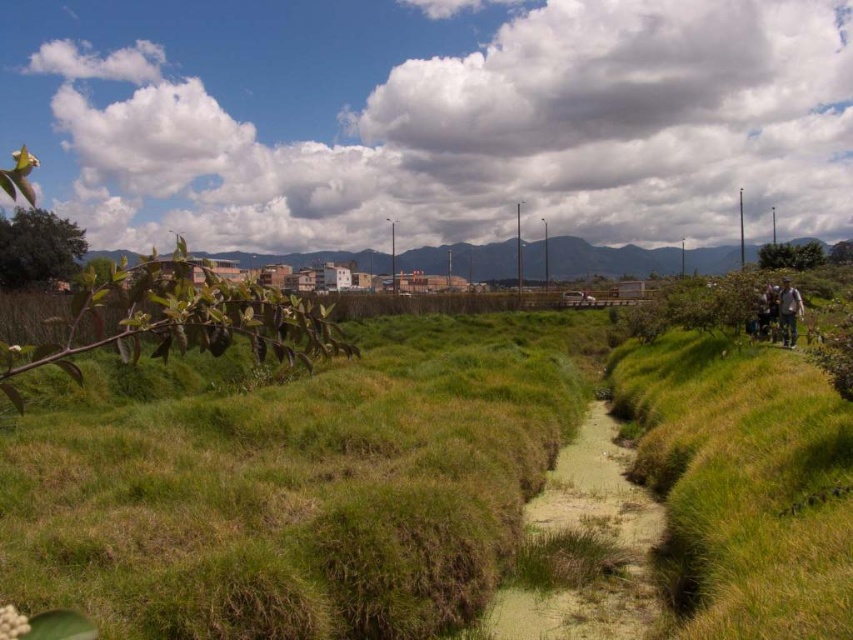
Can you confirm if green grassy hill at center is shorter than camouflage fabric jacket at right?

In fact, green grassy hill at center may be taller than camouflage fabric jacket at right.

Measure the distance from green grassy hill at center to camouflage fabric jacket at right.

green grassy hill at center and camouflage fabric jacket at right are 44.53 meters apart.

The image size is (853, 640). Identify the location of green grassy hill at center. (607, 259).